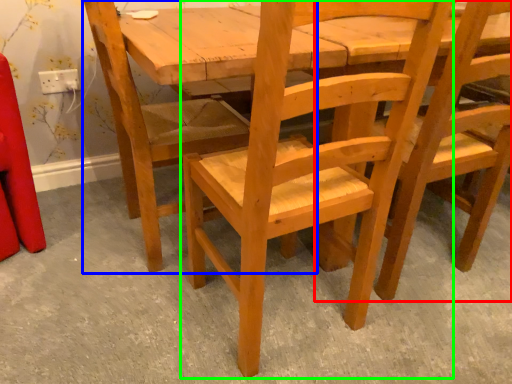
Question: Which is farther away from chair (highlighted by a red box)? chair (highlighted by a blue box) or chair (highlighted by a green box)?

Choices:
 (A) chair
 (B) chair

Answer: (A)